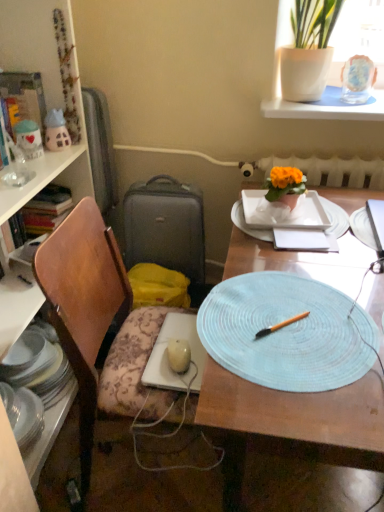
This screenshot has height=512, width=384. Identify the location of vacant space underneath light blue woven placemat at center, which is the second platter in back-to-front order (from a real-world perspective). (x=305, y=333).